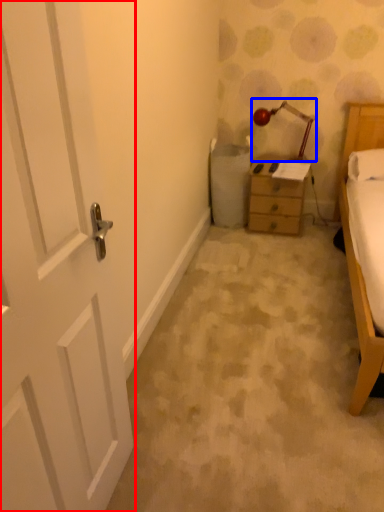
Question: Which of the following is the closest to the observer, door (highlighted by a red box) or lamp (highlighted by a blue box)?

Choices:
 (A) door
 (B) lamp

Answer: (A)